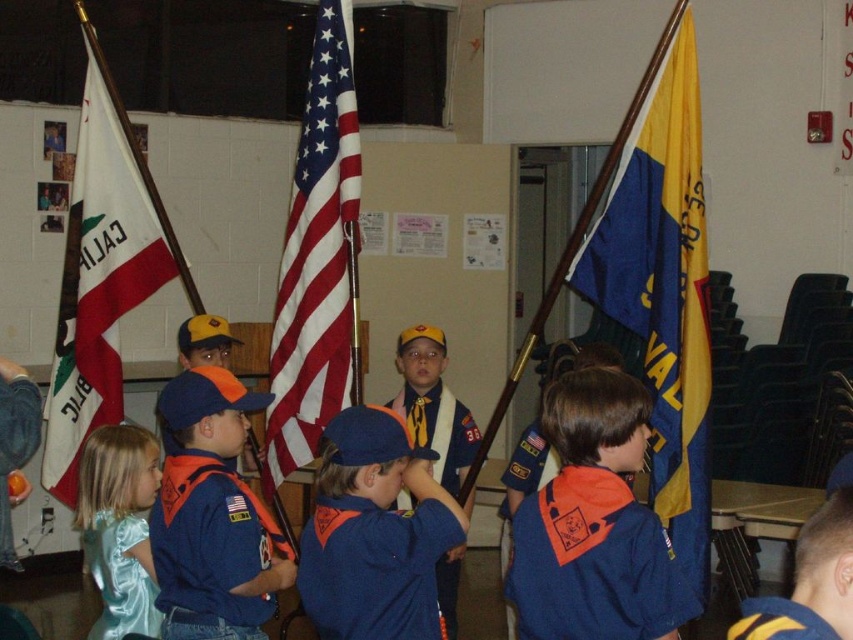
You are standing at the front of the room facing the group. There is a point at coordinates point (316,257). Which flag is this point located on?

The point (316,257) is located on the American flag at center.

You are standing in the middle of the flag ceremony scene. There are two points marked in the image. The first point is at coordinates point (315,52) and the second point is at point (131,428). Which point is closer to you?

The point at coordinates point (315,52) is closer to you because it is further to the viewer than point (131,428).